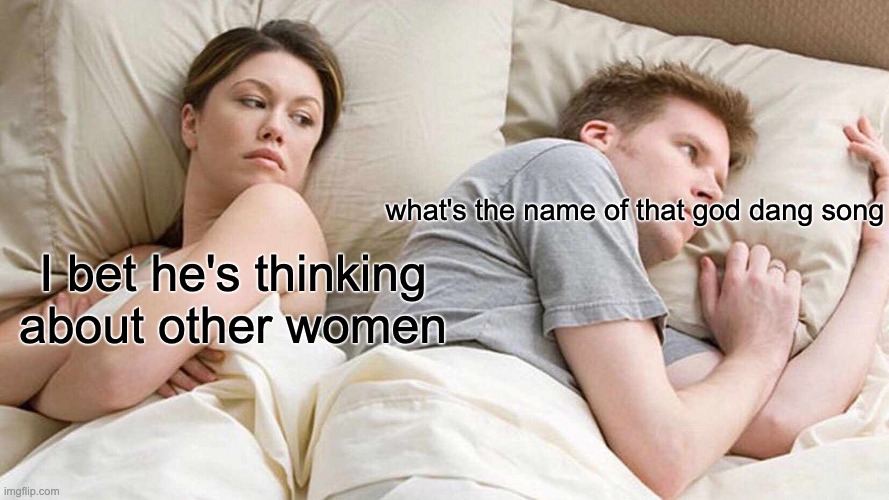
Where is `pillow`? The height and width of the screenshot is (500, 889). pillow is located at coordinates (413, 80), (365, 143), (380, 14), (811, 106), (790, 157), (113, 93), (113, 55).